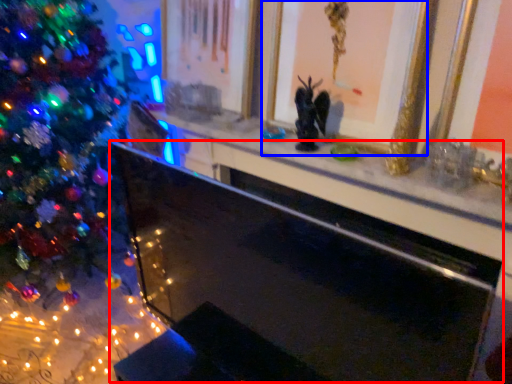
Question: Which of the following is the farthest to the observer, fireplace (highlighted by a red box) or picture frame (highlighted by a blue box)?

Choices:
 (A) fireplace
 (B) picture frame

Answer: (B)